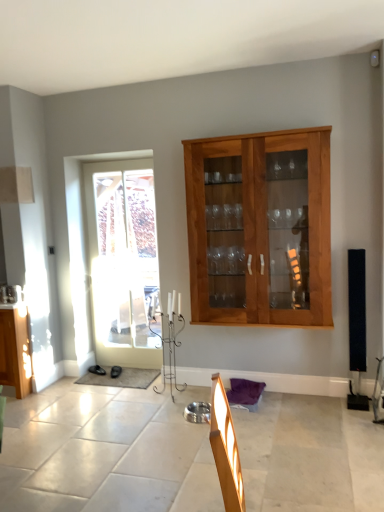
Question: Is wooden cabinet at center smaller than black matte speaker at right?

Choices:
 (A) yes
 (B) no

Answer: (B)

Question: Is wooden cabinet at center surrounding black matte speaker at right?

Choices:
 (A) yes
 (B) no

Answer: (B)

Question: Is there a large distance between wooden cabinet at center and black matte speaker at right?

Choices:
 (A) no
 (B) yes

Answer: (A)

Question: Does wooden cabinet at center come in front of black matte speaker at right?

Choices:
 (A) yes
 (B) no

Answer: (A)

Question: Is wooden cabinet at center behind black matte speaker at right?

Choices:
 (A) no
 (B) yes

Answer: (A)

Question: From a real-world perspective, does wooden cabinet at center stand above black matte speaker at right?

Choices:
 (A) yes
 (B) no

Answer: (A)

Question: Considering the relative sizes of white glass door at left and wooden cabinet at center in the image provided, is white glass door at left thinner than wooden cabinet at center?

Choices:
 (A) no
 (B) yes

Answer: (B)

Question: Is wooden cabinet at center at the back of white glass door at left?

Choices:
 (A) yes
 (B) no

Answer: (B)

Question: From the image's perspective, is white glass door at left over wooden cabinet at center?

Choices:
 (A) no
 (B) yes

Answer: (A)

Question: Is white glass door at left positioned beyond the bounds of wooden cabinet at center?

Choices:
 (A) yes
 (B) no

Answer: (A)

Question: Considering the relative sizes of white glass door at left and wooden cabinet at center in the image provided, is white glass door at left smaller than wooden cabinet at center?

Choices:
 (A) no
 (B) yes

Answer: (B)

Question: Is white glass door at left positioned behind wooden cabinet at center?

Choices:
 (A) no
 (B) yes

Answer: (B)

Question: Are black matte speaker at right and white glass door at left located far from each other?

Choices:
 (A) yes
 (B) no

Answer: (A)